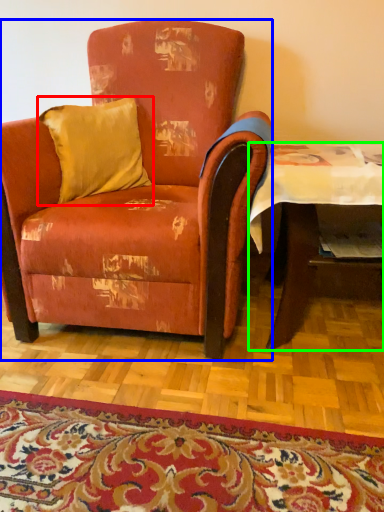
Question: Which object is the farthest from pillow (highlighted by a red box)? Choose among these: chair (highlighted by a blue box) or table (highlighted by a green box).

Choices:
 (A) chair
 (B) table

Answer: (B)